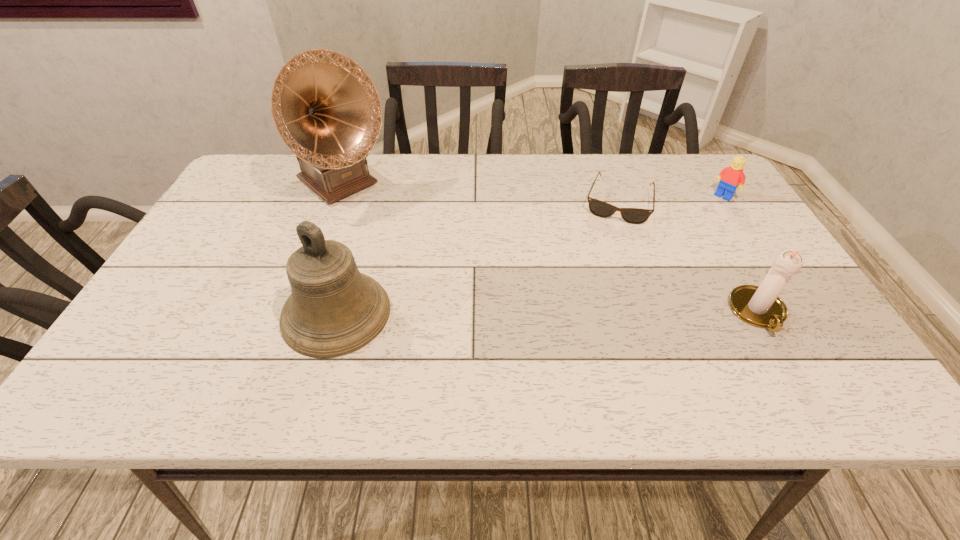
Locate an element on the screen. The width and height of the screenshot is (960, 540). vacant spot on the desktop that is between the fourth shortest object and the third tallest object and is positioned on the lenses of the shortest object is located at coordinates (591, 313).

Identify the location of vacant space on the desktop that is between the second tallest object and the second object from right to left and is positioned on the face of the Lego. The image size is (960, 540). 596,313.

Locate an element on the screen. vacant space on the desktop that is between the bell and the third tallest object and is positioned on the horn of the phonograph record is located at coordinates (500, 313).